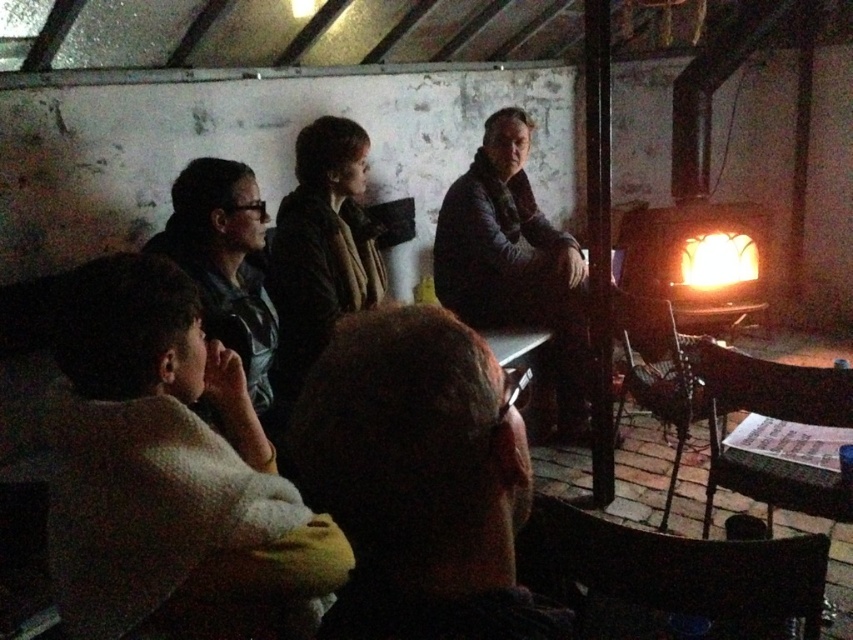
You are a photographer trying to capture a closeup of the brown hair at center and dark blue leather jacket at center in the scene. Since the camera can only focus on one object at a time, which object should you prioritize to ensure it fills more of the frame?

The dark blue leather jacket at center should be prioritized because it occupies more space than the brown hair at center, making it better suited to fill the camera frame.